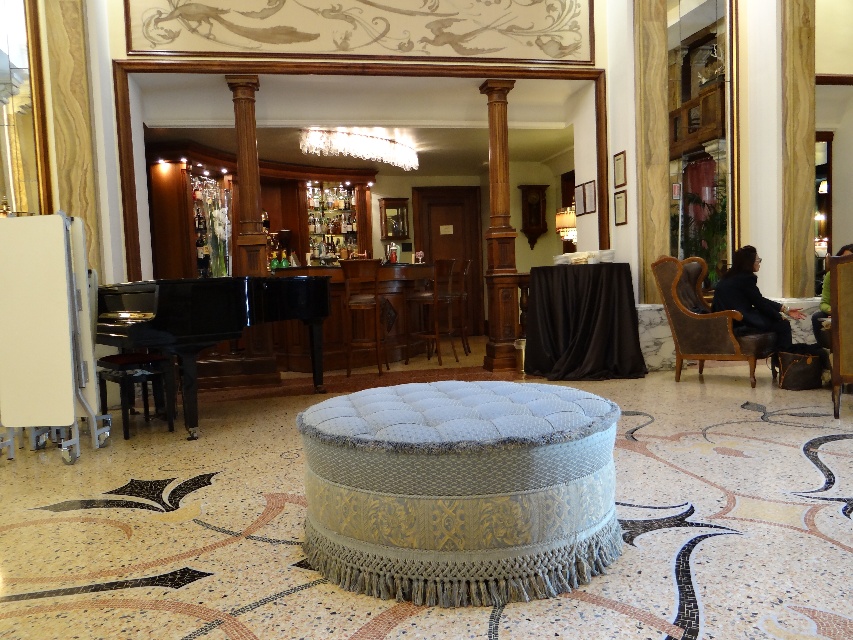
Question: Based on their relative distances, which object is farther from the white glass chandelier at upper center?

Choices:
 (A) brown polished wood column at center
 (B) black leather stool at lower left

Answer: (B)

Question: Which object is positioned closest to the black polished piano at left?

Choices:
 (A) white glass chandelier at upper center
 (B) brown leather armchair at right
 (C) brown leather armchair at center

Answer: (C)

Question: Can you confirm if black leather stool at lower left is thinner than brown leather armchair at center?

Choices:
 (A) yes
 (B) no

Answer: (B)

Question: Can you confirm if black leather stool at lower left is positioned to the right of white glass chandelier at upper center?

Choices:
 (A) no
 (B) yes

Answer: (A)

Question: Observing the image, what is the correct spatial positioning of white glass chandelier at upper center in reference to brown wooden bar stool at center?

Choices:
 (A) above
 (B) below

Answer: (A)

Question: Among these points, which one is farthest from the camera?

Choices:
 (A) (318, 131)
 (B) (376, 273)
 (C) (491, 232)
 (D) (685, 317)

Answer: (A)